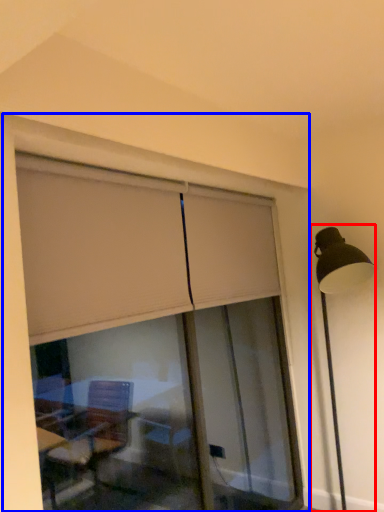
Question: Which of the following is the farthest to the observer, lamp post (highlighted by a red box) or window frame (highlighted by a blue box)?

Choices:
 (A) lamp post
 (B) window frame

Answer: (A)